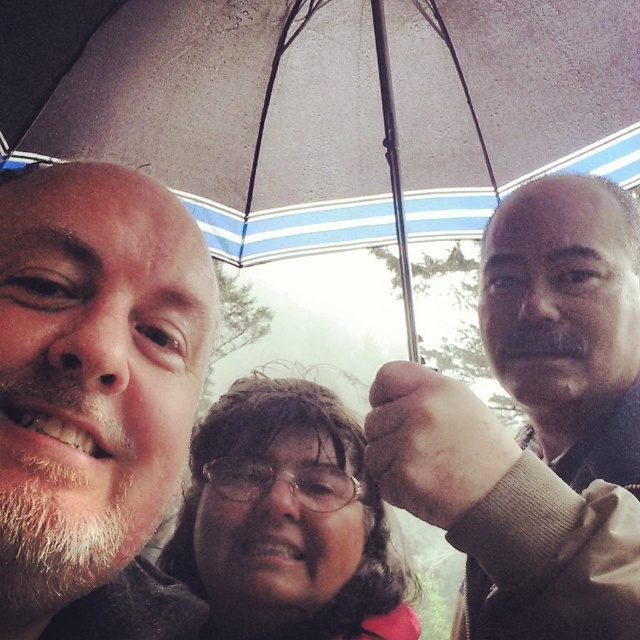
Does transparent fabric umbrella at upper center appear on the right side of brown matte glasses at center?

Correct, you'll find transparent fabric umbrella at upper center to the right of brown matte glasses at center.

In the scene shown: Who is more forward, (72, 48) or (298, 403)?

Point (298, 403)

Find the location of a particular element. The image size is (640, 640). transparent fabric umbrella at upper center is located at coordinates (326, 108).

Is transparent fabric umbrella at upper center bigger than matte black glasses at center?

Yes, transparent fabric umbrella at upper center is bigger than matte black glasses at center.

Which is in front, point (292, 252) or point (278, 461)?

Point (278, 461)

The image size is (640, 640). In order to click on transparent fabric umbrella at upper center in this screenshot , I will do `click(326, 108)`.

Find the location of a particular element. The height and width of the screenshot is (640, 640). gray matte face at upper right is located at coordinates (561, 294).

Which is more to the left, gray matte face at upper right or matte black glasses at center?

matte black glasses at center

Identify the location of gray matte face at upper right. (561, 294).

Where is `gray matte face at upper right`? This screenshot has width=640, height=640. gray matte face at upper right is located at coordinates (561, 294).